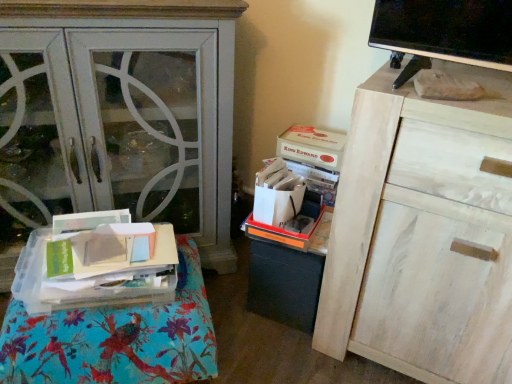
Question: Does matte white cabinet at left come behind orange plastic storage box at center, which is counted as the 2th storage box, starting from the top?

Choices:
 (A) yes
 (B) no

Answer: (B)

Question: Considering the relative sizes of matte white cabinet at left and orange plastic storage box at center, which is the 1th storage box from bottom to top, in the image provided, is matte white cabinet at left smaller than orange plastic storage box at center, which is the 1th storage box from bottom to top,?

Choices:
 (A) yes
 (B) no

Answer: (B)

Question: Is matte white cabinet at left shorter than orange plastic storage box at center, which is counted as the 2th storage box, starting from the top?

Choices:
 (A) yes
 (B) no

Answer: (B)

Question: Is orange plastic storage box at center, which is the 1th storage box from bottom to top, at the back of matte white cabinet at left?

Choices:
 (A) no
 (B) yes

Answer: (A)

Question: From a real-world perspective, is matte white cabinet at left over orange plastic storage box at center, which is counted as the 2th storage box, starting from the top?

Choices:
 (A) yes
 (B) no

Answer: (A)

Question: Would you say clear plastic tray at lower left is to the left or to the right of white wood cabinet at upper right in the picture?

Choices:
 (A) left
 (B) right

Answer: (A)

Question: Would you say clear plastic tray at lower left is inside or outside white wood cabinet at upper right?

Choices:
 (A) inside
 (B) outside

Answer: (B)

Question: From the image's perspective, is clear plastic tray at lower left positioned above or below white wood cabinet at upper right?

Choices:
 (A) below
 (B) above

Answer: (A)

Question: Considering the positions of point (71, 345) and point (468, 203), is point (71, 345) closer or farther from the camera than point (468, 203)?

Choices:
 (A) farther
 (B) closer

Answer: (A)

Question: Considering the positions of clear plastic tray at lower left and orange plastic storage box at center, which is counted as the 2th storage box, starting from the top, in the image, is clear plastic tray at lower left wider or thinner than orange plastic storage box at center, which is counted as the 2th storage box, starting from the top,?

Choices:
 (A) wide
 (B) thin

Answer: (A)

Question: In the image, is clear plastic tray at lower left on the left side or the right side of orange plastic storage box at center, which is the 1th storage box from bottom to top?

Choices:
 (A) right
 (B) left

Answer: (B)

Question: Does point (152, 355) appear closer or farther from the camera than point (280, 240)?

Choices:
 (A) farther
 (B) closer

Answer: (B)

Question: Considering the positions of clear plastic tray at lower left and orange plastic storage box at center, which is counted as the 2th storage box, starting from the top, in the image, is clear plastic tray at lower left taller or shorter than orange plastic storage box at center, which is counted as the 2th storage box, starting from the top,?

Choices:
 (A) short
 (B) tall

Answer: (B)

Question: Is white wood cabinet at upper right bigger or smaller than orange plastic storage box at center, which is counted as the 2th storage box, starting from the top?

Choices:
 (A) small
 (B) big

Answer: (B)

Question: From a real-world perspective, is white wood cabinet at upper right positioned above or below orange plastic storage box at center, which is counted as the 2th storage box, starting from the top?

Choices:
 (A) above
 (B) below

Answer: (A)